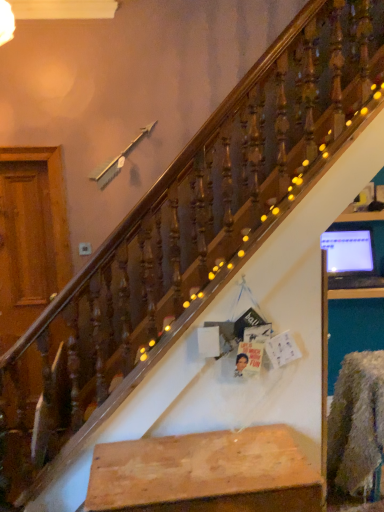
Question: Visually, is wooden plank at center positioned to the left or to the right of matte black monitor at upper right?

Choices:
 (A) left
 (B) right

Answer: (A)

Question: From the image's perspective, is wooden plank at center above or below matte black monitor at upper right?

Choices:
 (A) below
 (B) above

Answer: (A)

Question: From a real-world perspective, is wooden plank at center above or below matte black monitor at upper right?

Choices:
 (A) below
 (B) above

Answer: (A)

Question: Is matte black monitor at upper right wider or thinner than wooden plank at center?

Choices:
 (A) wide
 (B) thin

Answer: (B)

Question: Based on their sizes in the image, would you say matte black monitor at upper right is bigger or smaller than wooden plank at center?

Choices:
 (A) small
 (B) big

Answer: (A)

Question: Is matte black monitor at upper right to the left or to the right of wooden plank at center in the image?

Choices:
 (A) left
 (B) right

Answer: (B)

Question: Relative to wooden plank at center, is matte black monitor at upper right in front or behind?

Choices:
 (A) front
 (B) behind

Answer: (B)